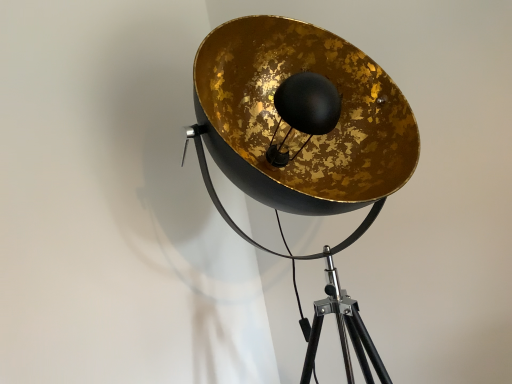
Describe the element at coordinates (296, 127) in the screenshot. I see `gold leaf lampshade at center` at that location.

Find the location of `gold leaf lampshade at center`. gold leaf lampshade at center is located at coordinates (296, 127).

What are the coordinates of `gold leaf lampshade at center` in the screenshot? It's located at (296, 127).